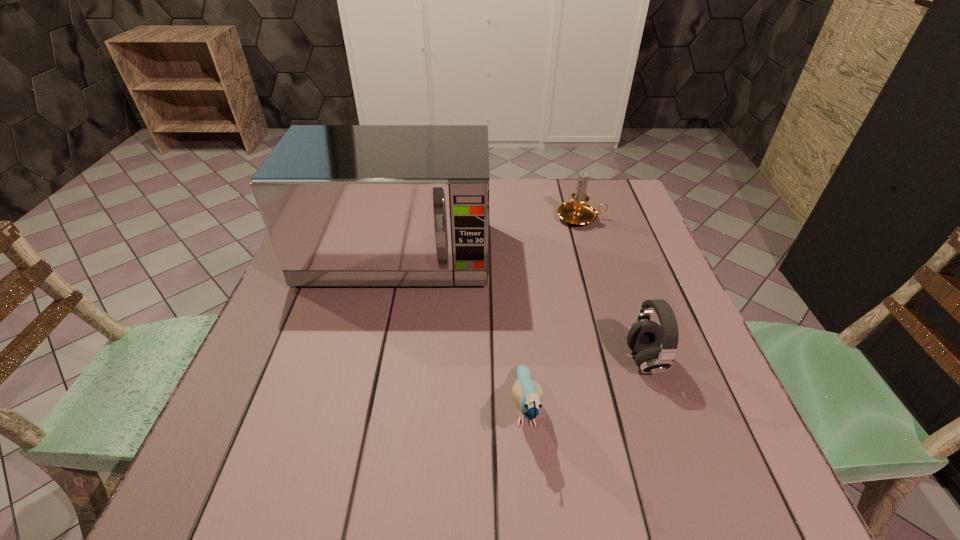
The width and height of the screenshot is (960, 540). What are the coordinates of `free point located at the face of the second object from left to right` in the screenshot? It's located at (532, 488).

Locate an element on the screen. Image resolution: width=960 pixels, height=540 pixels. object situated at the far edge is located at coordinates (578, 213).

Locate an element on the screen. The height and width of the screenshot is (540, 960). object situated at the near edge is located at coordinates (528, 394).

Identify the location of object located in the left edge section of the desktop. (344, 205).

Where is `candle present at the right edge`? The height and width of the screenshot is (540, 960). candle present at the right edge is located at coordinates (578, 213).

Where is `headset situated at the right edge`? headset situated at the right edge is located at coordinates (644, 337).

In order to click on object at the far right corner in this screenshot , I will do `click(578, 213)`.

In the image, there is a desktop. Find the location of `free region at the far edge`. free region at the far edge is located at coordinates (520, 181).

I want to click on free space at the near edge, so click(462, 481).

The width and height of the screenshot is (960, 540). Identify the location of free space at the left edge of the desktop. (267, 411).